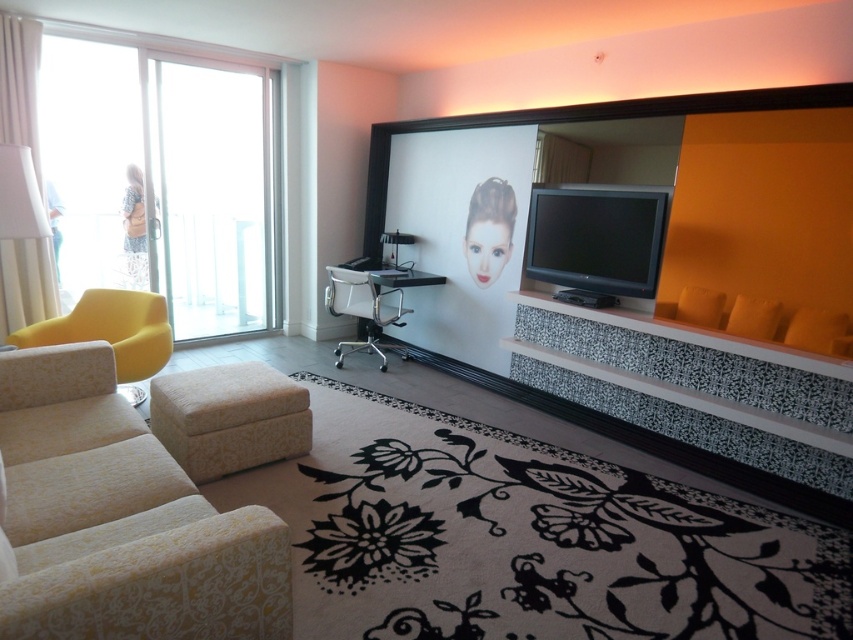
Question: Estimate the real-world distances between objects in this image. Which object is farther from the beige floral fabric couch at lower left?

Choices:
 (A) yellow fabric chair at left
 (B) floral fabric ottoman at center
 (C) transparent glass door at left

Answer: (C)

Question: Is transparent glass door at left further to camera compared to floral fabric ottoman at center?

Choices:
 (A) yes
 (B) no

Answer: (A)

Question: Which point is closer to the camera taking this photo?

Choices:
 (A) (305, 444)
 (B) (155, 364)
 (C) (231, 305)
 (D) (167, 545)

Answer: (D)

Question: Is transparent glass door at left thinner than yellow fabric chair at left?

Choices:
 (A) yes
 (B) no

Answer: (B)

Question: From the image, what is the correct spatial relationship of beige floral fabric couch at lower left in relation to yellow fabric chair at left?

Choices:
 (A) above
 (B) below

Answer: (B)

Question: Which point is closer to the camera taking this photo?

Choices:
 (A) (215, 259)
 (B) (244, 451)

Answer: (B)